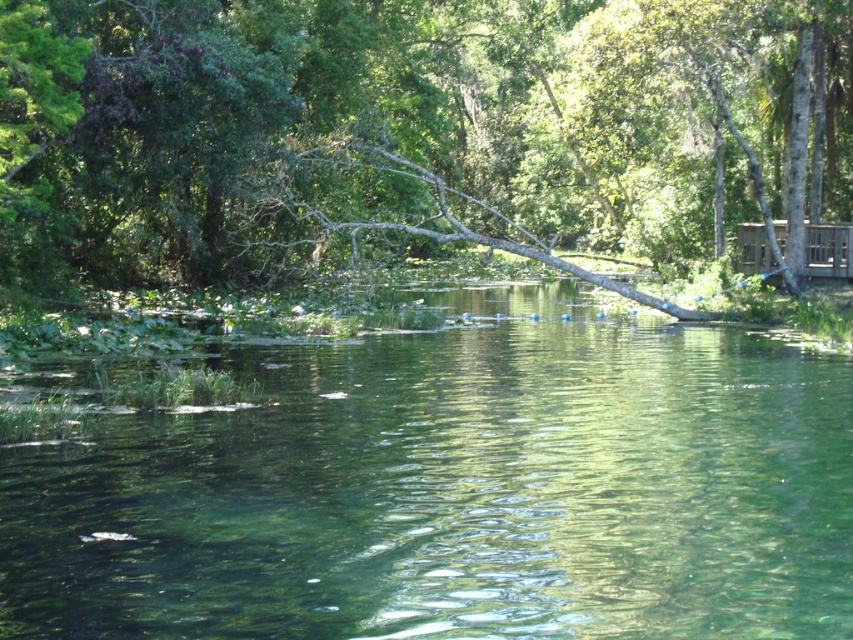
Find the location of `green leafy tree at center`. green leafy tree at center is located at coordinates (410, 131).

Does point (601, 230) lie in front of point (811, 253)?

That is False.

The width and height of the screenshot is (853, 640). I want to click on green leafy tree at center, so click(410, 131).

Which is behind, point (554, 444) or point (844, 275)?

The point (844, 275) is behind.

Can you confirm if clear water at center is wider than wooden cabin at right?

Correct, the width of clear water at center exceeds that of wooden cabin at right.

Is point (88, 576) farther from camera compared to point (740, 260)?

No.

Image resolution: width=853 pixels, height=640 pixels. In order to click on clear water at center in this screenshot , I will do `click(457, 490)`.

Can you confirm if clear water at center is positioned to the left of green leafy tree at center?

Yes, clear water at center is to the left of green leafy tree at center.

Between clear water at center and green leafy tree at center, which one appears on the right side from the viewer's perspective?

green leafy tree at center is more to the right.

Image resolution: width=853 pixels, height=640 pixels. What do you see at coordinates (457, 490) in the screenshot?
I see `clear water at center` at bounding box center [457, 490].

This screenshot has width=853, height=640. Find the location of `clear water at center`. clear water at center is located at coordinates (457, 490).